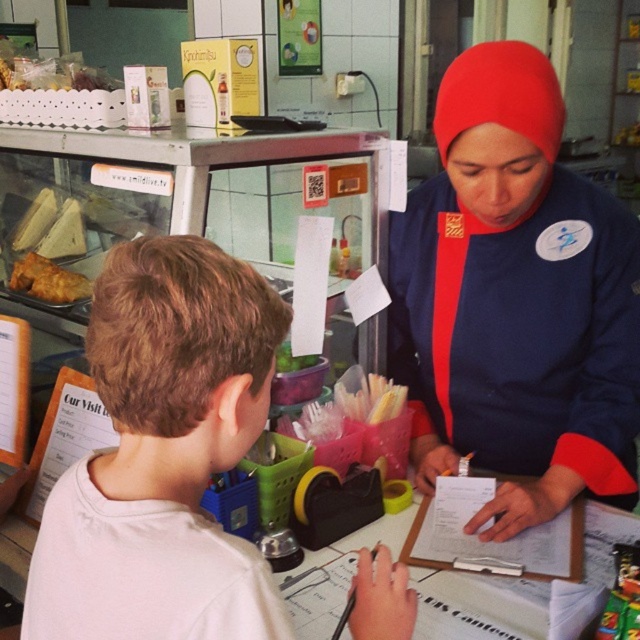
You are a customer trying to place an order at the counter. You notice two items in front of you. Which one is on the right side, the blue fabric hijab at center or the white matte shirt at center?

The blue fabric hijab at center is positioned on the right side of white matte shirt at center.

You are a customer standing at the counter in the food service establishment. You need to reach both the white matte shirt at center and the golden crispy pastry at left. Which item is closer to you?

The white matte shirt at center is 36.24 inches away from the golden crispy pastry at left, so the golden crispy pastry at left is closer to you since it is only 36.24 inches away from the white matte shirt at center which is presumably at your position.

You are a customer in a cafe and you want to order the golden crispy pastry at left. The cashier is wearing the white matte shirt at center. When you approach the counter, which object will you see first?

The golden crispy pastry at left will be seen first because it is smaller and positioned to the left side of the white matte shirt at center.